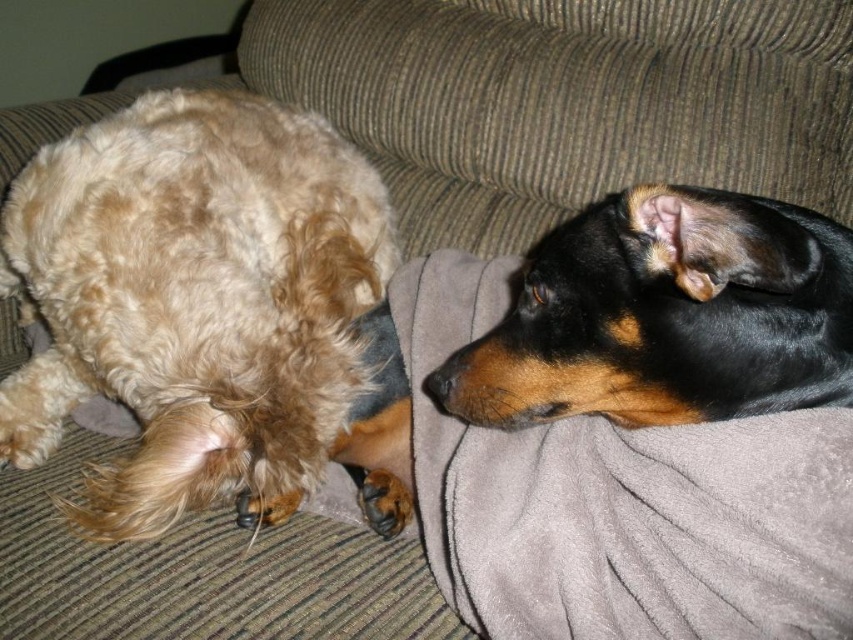
You are a photographer trying to capture both the fluffy golden fur at left and the black shiny dog at upper right in a single frame. Based on their positions, which dog should you focus on first to ensure both are in the shot?

The fluffy golden fur at left is to the left of the black shiny dog at upper right, so you should focus on the black shiny dog at upper right first to ensure both are in the frame.

You are a pet sitter who needs to place a 16 inch long toy between the gray soft blanket at upper center and the black shiny dog at upper right. Is there enough space to place the toy without moving either object?

The distance between the gray soft blanket at upper center and the black shiny dog at upper right is 17.53 inches. Since the toy is 16 inches long, there is enough space to place it between them without moving either object.